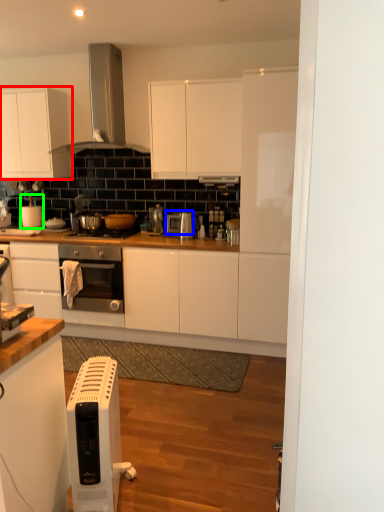
Question: Estimate the real-world distances between objects in this image. Which object is farther from cabinetry (highlighted by a red box), appliance (highlighted by a blue box) or appliance (highlighted by a green box)?

Choices:
 (A) appliance
 (B) appliance

Answer: (A)